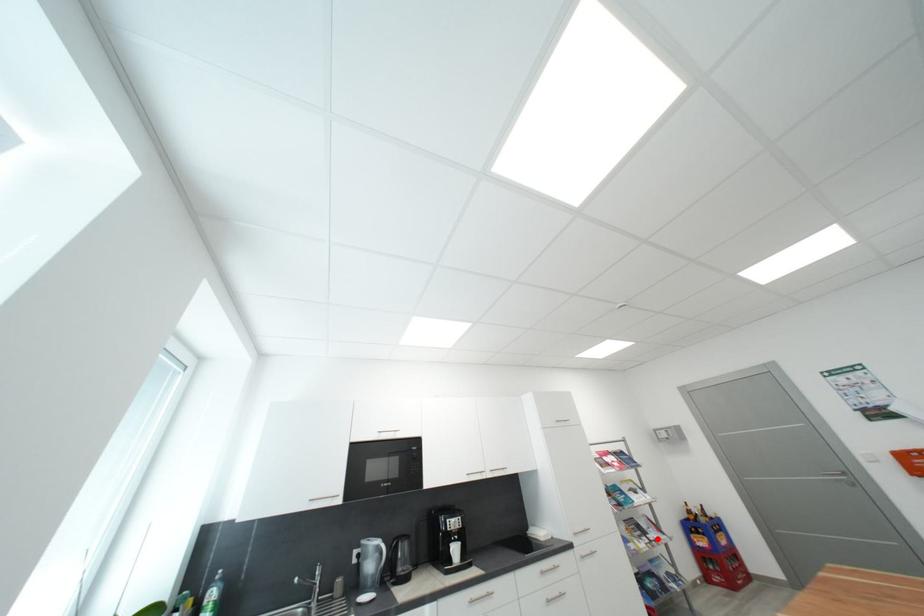
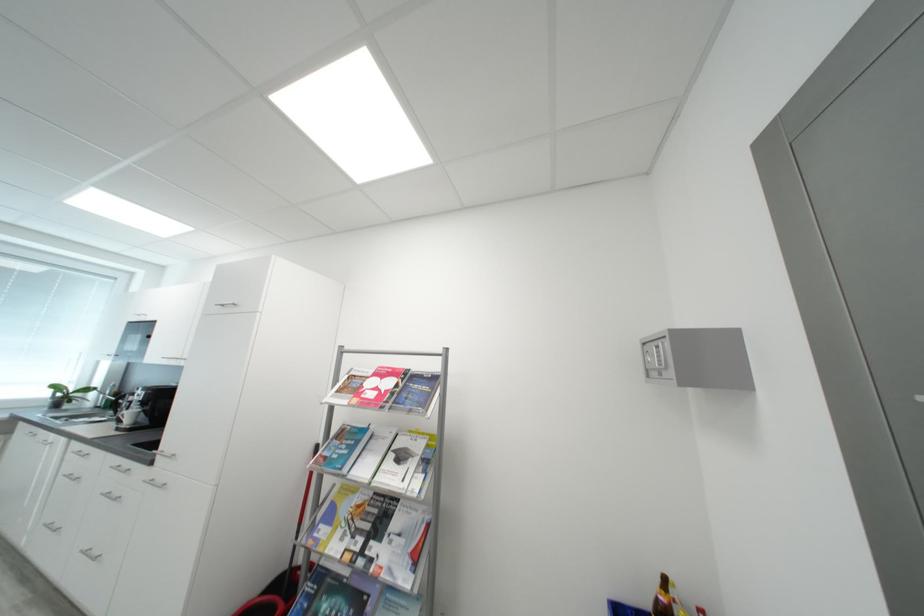
Question: I am providing you with two images of the same scene from different viewpoints. A red point is marked on the first image. Is the red point's position out of view in image 2?

Choices:
 (A) Yes
 (B) No

Answer: (B)